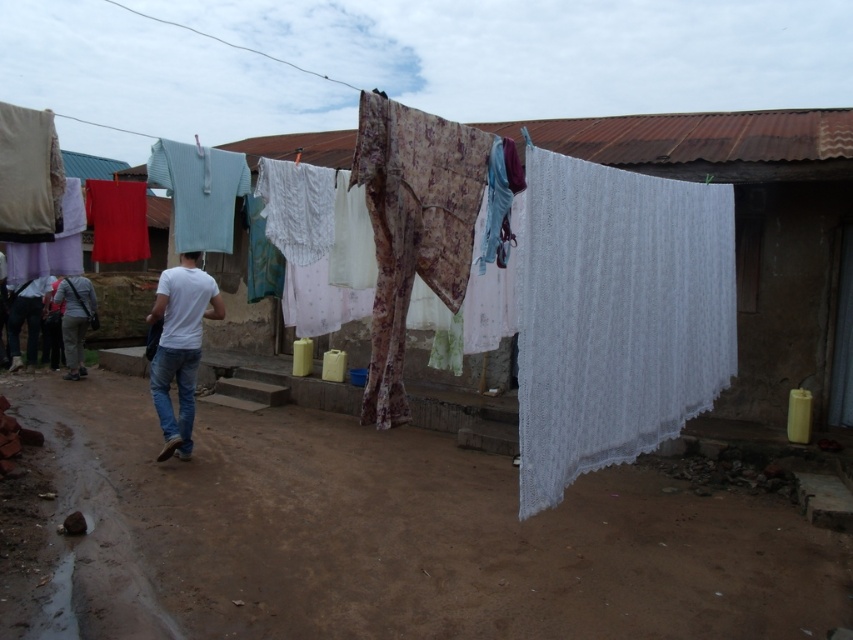
You are trying to hang a new red towel on the clothesline. The clothesline currently has a white lace cloth at center and jeans at center. Which object should you place the new towel next to so that it doesn

The white lace cloth at center might be wider than jeans at center, so placing the new red towel next to the jeans at center would leave more space for the towel to spread out properly.